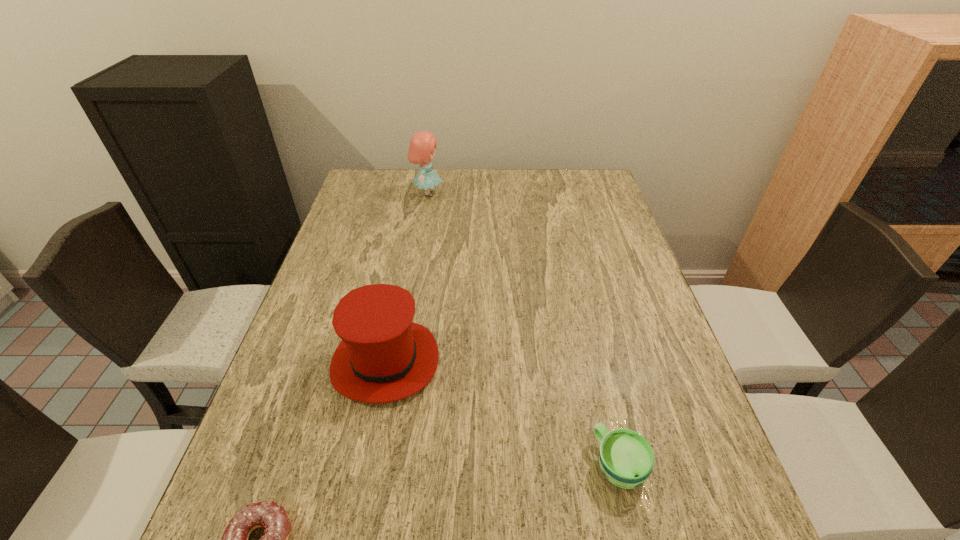
The width and height of the screenshot is (960, 540). I want to click on object that is at the left edge, so click(383, 357).

Locate an element on the screen. object that is at the right edge is located at coordinates (626, 458).

The height and width of the screenshot is (540, 960). I want to click on vacant space at the far edge of the desktop, so click(550, 172).

Identify the location of free space at the left edge. This screenshot has height=540, width=960. (358, 233).

The height and width of the screenshot is (540, 960). In the image, there is a desktop. In order to click on blank space at the right edge in this screenshot , I will do `click(691, 406)`.

You are a GUI agent. You are given a task and a screenshot of the screen. Output one action in this format:
    pyautogui.click(x=<x>, y=<y>)
    Task: Click on the vacant space at the far left corner
    
    Given the screenshot: What is the action you would take?
    pyautogui.click(x=359, y=203)

In the image, there is a desktop. At what (x,y) coordinates should I click in order to perform the action: click on vacant space at the far right corner. Please return your answer as a coordinate pair (x, y). Looking at the image, I should click on (597, 183).

This screenshot has height=540, width=960. I want to click on free spot between the hat and the doll, so click(x=406, y=278).

At what (x,y) coordinates should I click in order to perform the action: click on free space between the farthest object and the hat. Please return your answer as a coordinate pair (x, y). The width and height of the screenshot is (960, 540). Looking at the image, I should click on (406, 278).

In order to click on vacant space that's between the rightmost object and the third nearest object in this screenshot , I will do `click(502, 414)`.